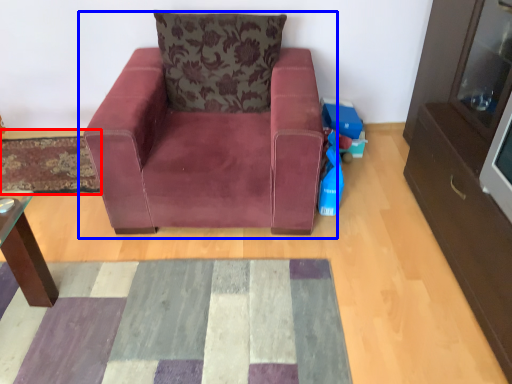
Question: Which object appears farthest to the camera in this image, mat (highlighted by a red box) or chair (highlighted by a blue box)?

Choices:
 (A) mat
 (B) chair

Answer: (A)